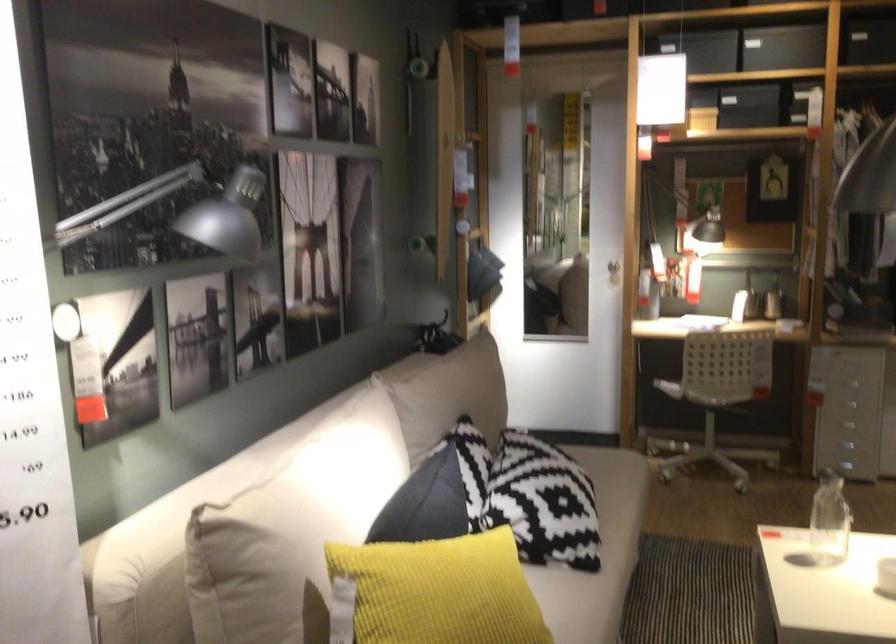
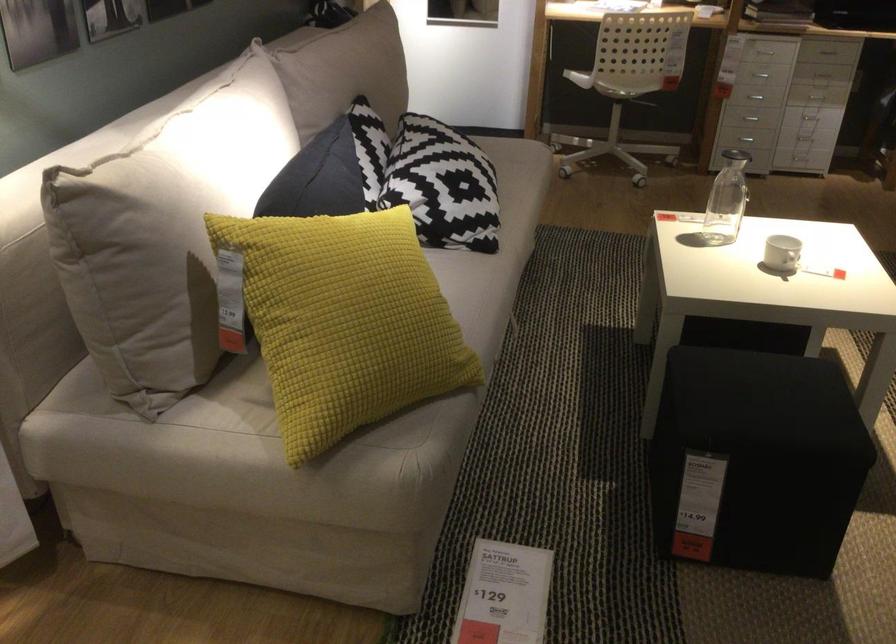
Find the pixel in the second image that matches point (424, 509) in the first image.

(317, 178)